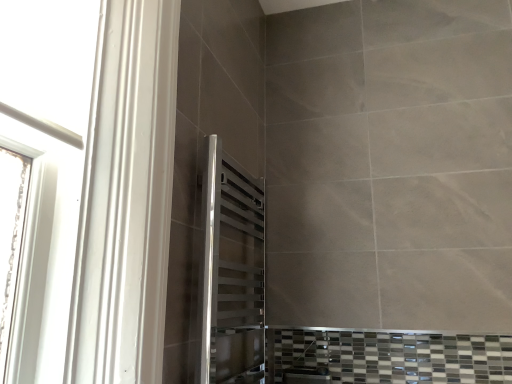
What is the approximate height of polished chrome towel rack at center?

polished chrome towel rack at center is 80.76 centimeters tall.

What do you see at coordinates (231, 272) in the screenshot? I see `polished chrome towel rack at center` at bounding box center [231, 272].

I want to click on polished chrome towel rack at center, so click(231, 272).

The height and width of the screenshot is (384, 512). Find the location of `polished chrome towel rack at center`. polished chrome towel rack at center is located at coordinates (231, 272).